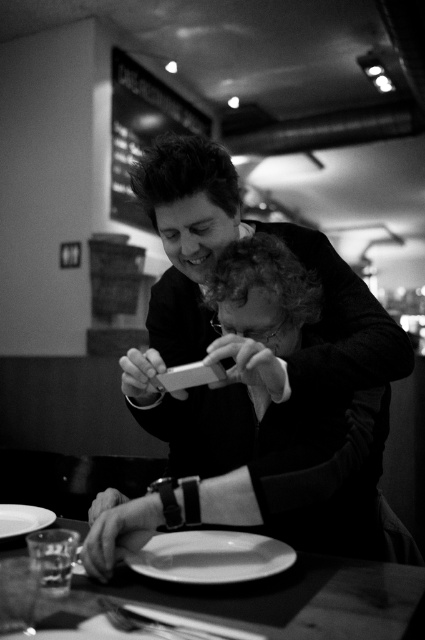
Is point (422, 580) less distant than point (187, 556)?

Yes, it is in front of point (187, 556).

Based on the photo, between smooth wooden table at center and white glossy plate at lower center, which one has less height?

smooth wooden table at center is shorter.

Who is more forward, [359,628] or [221,538]?

Point [359,628] is in front.

Find the location of a particular element. Image resolution: width=425 pixels, height=640 pixels. smooth wooden table at center is located at coordinates (283, 600).

Between smooth plastic phone at center and white glossy plate at lower center, which one has less height?

white glossy plate at lower center

Between point (292, 452) and point (175, 560), which one is positioned behind?

The point (292, 452) is more distant.

The height and width of the screenshot is (640, 425). Describe the element at coordinates (255, 384) in the screenshot. I see `smooth plastic phone at center` at that location.

At what (x,y) coordinates should I click in order to perform the action: click on smooth plastic phone at center. Please return your answer as a coordinate pair (x, y). Looking at the image, I should click on (255, 384).

Between point (197, 566) and point (40, 509), which one is positioned behind?

The point (40, 509) is behind.

Who is taller, white glossy plate at lower center or white matte plate at lower left?

white glossy plate at lower center

The height and width of the screenshot is (640, 425). Describe the element at coordinates (206, 556) in the screenshot. I see `white glossy plate at lower center` at that location.

In order to click on white glossy plate at lower center in this screenshot , I will do `click(206, 556)`.